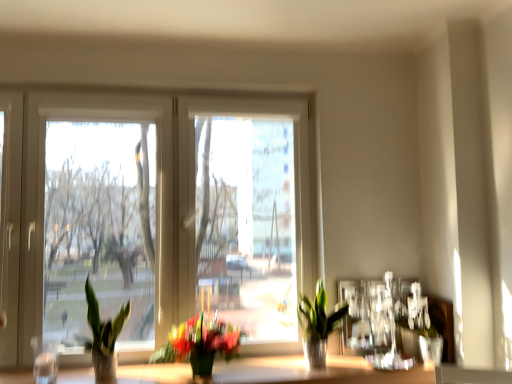
Question: From their relative heights in the image, would you say smooth wooden surface at lower center is taller or shorter than white plastic window at center?

Choices:
 (A) short
 (B) tall

Answer: (A)

Question: Considering the positions of smooth wooden surface at lower center and white plastic window at center in the image, is smooth wooden surface at lower center wider or thinner than white plastic window at center?

Choices:
 (A) thin
 (B) wide

Answer: (B)

Question: Estimate the real-world distances between objects in this image. Which object is farther from the green matte plant at center, arranged as the 2th houseplant when viewed from the left?

Choices:
 (A) green glossy plant at center, placed as the 3th houseplant when sorted from left to right
 (B) green matte plant at left, which ranks as the 3th houseplant in right-to-left order
 (C) smooth wooden surface at lower center
 (D) white plastic window at center

Answer: (A)

Question: Considering the real-world distances, which object is closest to the smooth wooden surface at lower center?

Choices:
 (A) white plastic window at center
 (B) green glossy plant at center, placed as the 3th houseplant when sorted from left to right
 (C) green matte plant at left, which ranks as the 3th houseplant in right-to-left order
 (D) green matte plant at center, arranged as the 2th houseplant when viewed from the left

Answer: (D)